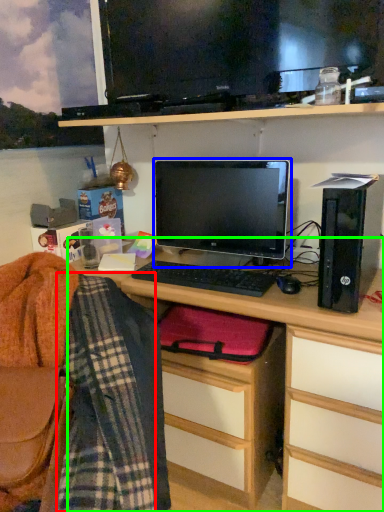
Question: Estimate the real-world distances between objects in this image. Which object is farther from plaid (highlighted by a red box), computer monitor (highlighted by a blue box) or desk (highlighted by a green box)?

Choices:
 (A) computer monitor
 (B) desk

Answer: (A)